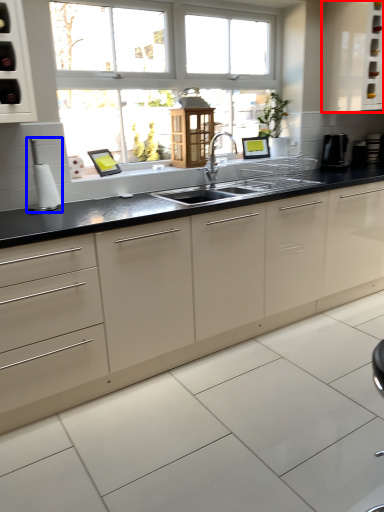
Question: Which object appears farthest to the camera in this image, cabinetry (highlighted by a red box) or appliance (highlighted by a blue box)?

Choices:
 (A) cabinetry
 (B) appliance

Answer: (A)